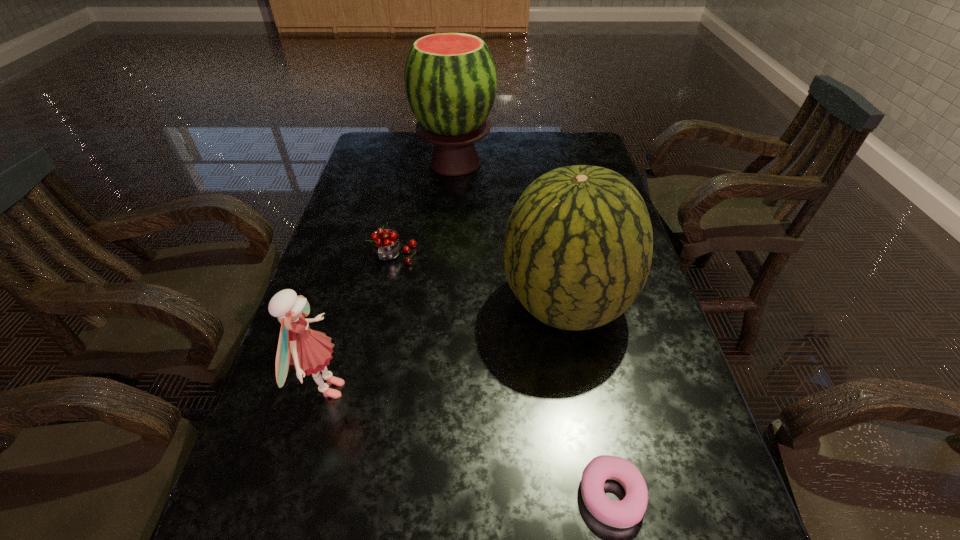
Find the location of a particular element. vacant area situated 0.370m on the back of the shortest object is located at coordinates (574, 308).

Identify the location of object at the far edge. The width and height of the screenshot is (960, 540). (450, 79).

This screenshot has height=540, width=960. Identify the location of doll located in the left edge section of the desktop. (309, 351).

Where is `cherry that is at the left edge`? This screenshot has height=540, width=960. cherry that is at the left edge is located at coordinates [385, 245].

Find the location of `watermelon that is at the right edge`. watermelon that is at the right edge is located at coordinates (578, 245).

At what (x,y) coordinates should I click in order to perform the action: click on pastry that is at the right edge. Please return your answer as a coordinate pair (x, y). The height and width of the screenshot is (540, 960). Looking at the image, I should click on (626, 513).

Find the location of a particular element. The height and width of the screenshot is (540, 960). free region at the far edge of the desktop is located at coordinates (492, 159).

Where is `vacant position at the left edge of the desktop`? vacant position at the left edge of the desktop is located at coordinates (350, 360).

Locate an element on the screen. The width and height of the screenshot is (960, 540). free space at the right edge is located at coordinates (x=701, y=503).

Locate an element on the screen. The image size is (960, 540). vacant area at the far right corner of the desktop is located at coordinates [557, 163].